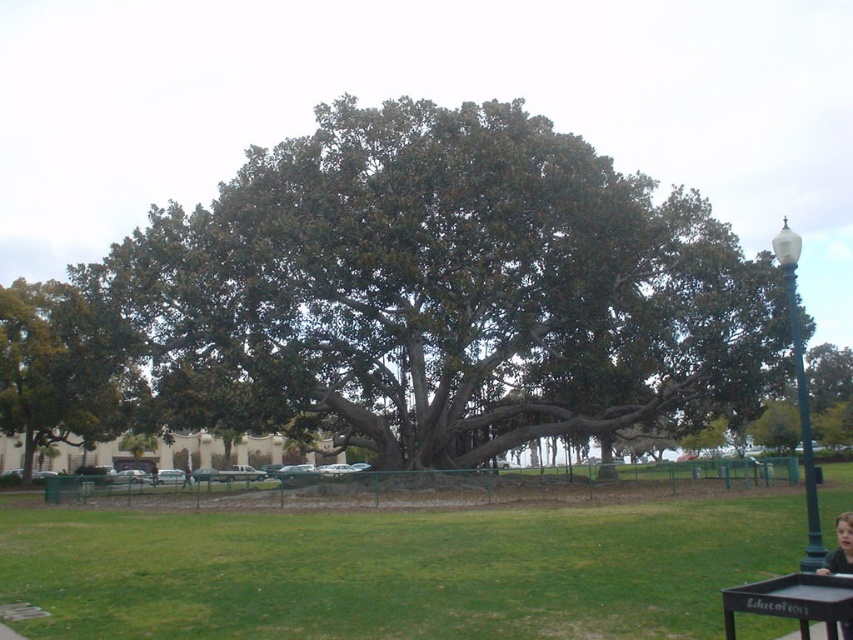
Does black painted wood picnic table at lower right appear on the right side of smooth black hair at lower right?

In fact, black painted wood picnic table at lower right is to the left of smooth black hair at lower right.

Can you confirm if black painted wood picnic table at lower right is positioned below smooth black hair at lower right?

No.

Find the location of a particular element. This screenshot has height=640, width=853. black painted wood picnic table at lower right is located at coordinates (792, 600).

Where is `black painted wood picnic table at lower right`? The image size is (853, 640). black painted wood picnic table at lower right is located at coordinates (792, 600).

Does green leafy tree at left have a larger size compared to smooth black hair at lower right?

Yes, green leafy tree at left is bigger than smooth black hair at lower right.

This screenshot has width=853, height=640. What are the coordinates of `green leafy tree at left` in the screenshot? It's located at (61, 369).

Does point (33, 410) come behind point (839, 516)?

Yes, point (33, 410) is behind point (839, 516).

Where is `green leafy tree at left`? green leafy tree at left is located at coordinates (61, 369).

Does green leafy oak tree at center appear over green leafy tree at left?

Correct, green leafy oak tree at center is located above green leafy tree at left.

Is green leafy oak tree at center to the left of green leafy tree at left from the viewer's perspective?

In fact, green leafy oak tree at center is to the right of green leafy tree at left.

Locate an element on the screen. This screenshot has width=853, height=640. green leafy oak tree at center is located at coordinates pyautogui.click(x=445, y=291).